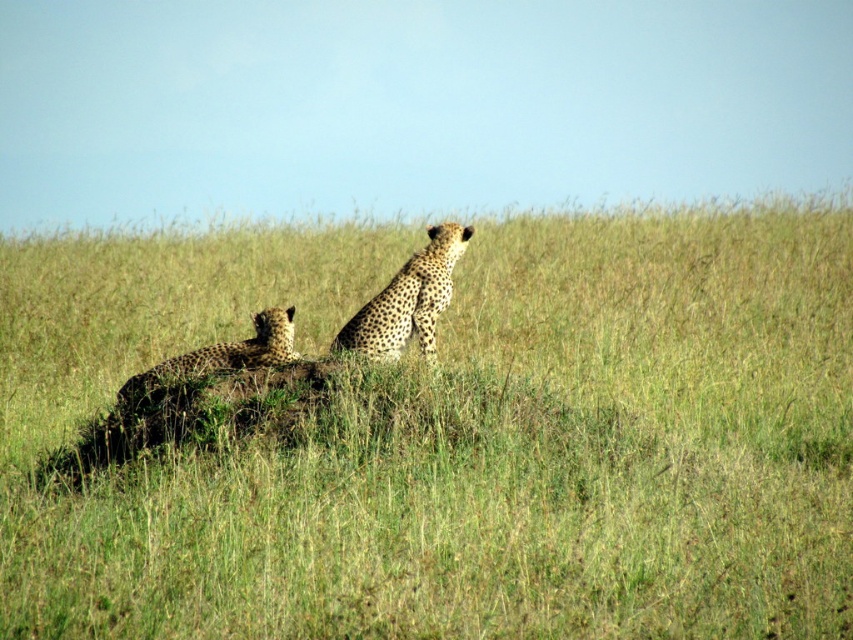
You are a photographer trying to capture a clear photo of the spotted fur cheetah at center. However, the green grass at center is blocking your view. Can you adjust your position to see the cheetah better?

The green grass at center is in front of the spotted fur cheetah at center, so moving your position to get a better angle behind the grass might allow you to see the cheetah more clearly.

You are a wildlife photographer aiming to capture a closeup shot of the green grass at center. Your camera has a minimum focusing distance of 5 meters. Can you take the photo without moving closer than 5 meters?

The green grass at center is 5.50 meters from the camera. Since your camera can focus as close as 5 meters, you are already within the required distance and can take the closeup shot.

You are a wildlife photographer trying to capture a clear shot of the spotted fur cheetah at lower left. Based on the scene, will the green grass at center block your view of the cheetah?

The green grass at center is taller than the spotted fur cheetah at lower left, so it may block your view of the cheetah.